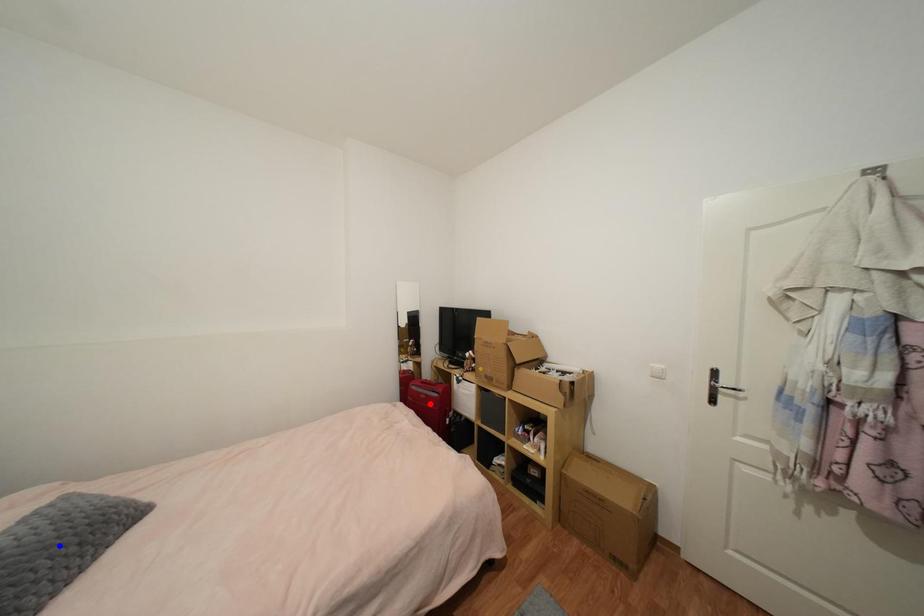
Question: Which of the two points in the image is closer to the camera?

Choices:
 (A) Blue point is closer.
 (B) Red point is closer.

Answer: (A)